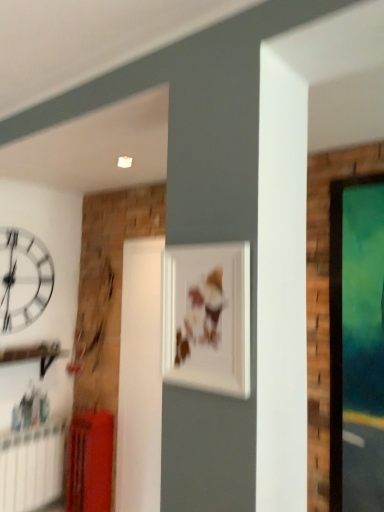
Question: From the image's perspective, is white glossy clock at upper left positioned above or below matte white picture frame at center?

Choices:
 (A) above
 (B) below

Answer: (B)

Question: Visually, is white glossy clock at upper left positioned to the left or to the right of matte white picture frame at center?

Choices:
 (A) right
 (B) left

Answer: (B)

Question: Estimate the real-world distances between objects in this image. Which object is closer to the white plastic radiator at lower left?

Choices:
 (A) matte red radiator at lower left
 (B) matte white picture frame at center
 (C) white glossy clock at upper left

Answer: (A)

Question: Estimate the real-world distances between objects in this image. Which object is closer to the white plastic radiator at lower left?

Choices:
 (A) matte white picture frame at center
 (B) white glossy clock at upper left
 (C) matte red radiator at lower left

Answer: (C)